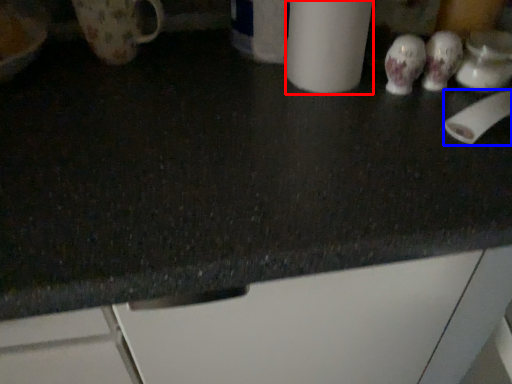
Question: Among these objects, which one is nearest to the camera, paper towel (highlighted by a red box) or toilet paper (highlighted by a blue box)?

Choices:
 (A) paper towel
 (B) toilet paper

Answer: (A)